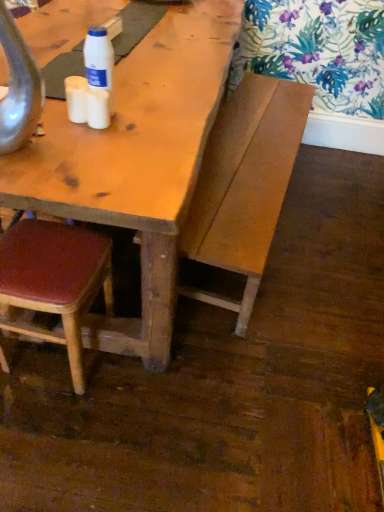
Question: Is white plastic bottle at upper center at the right side of wooden bench at center?

Choices:
 (A) no
 (B) yes

Answer: (A)

Question: Is the depth of white plastic bottle at upper center less than that of wooden bench at center?

Choices:
 (A) yes
 (B) no

Answer: (A)

Question: Is white plastic bottle at upper center bigger than wooden bench at center?

Choices:
 (A) no
 (B) yes

Answer: (A)

Question: From the image's perspective, is white plastic bottle at upper center located beneath wooden bench at center?

Choices:
 (A) yes
 (B) no

Answer: (B)

Question: Is white plastic bottle at upper center wider than wooden bench at center?

Choices:
 (A) no
 (B) yes

Answer: (A)

Question: Is white plastic bottle at upper center further to the viewer compared to wooden bench at center?

Choices:
 (A) no
 (B) yes

Answer: (A)

Question: Is white matte cup at center, placed as the first coffee cup when sorted from left to right, bigger than leatherette chair at lower left?

Choices:
 (A) no
 (B) yes

Answer: (A)

Question: From a real-world perspective, is white matte cup at center, placed as the first coffee cup when sorted from left to right, over leatherette chair at lower left?

Choices:
 (A) yes
 (B) no

Answer: (A)

Question: From the image's perspective, would you say white matte cup at center, placed as the first coffee cup when sorted from left to right, is shown under leatherette chair at lower left?

Choices:
 (A) yes
 (B) no

Answer: (B)

Question: Is white matte cup at center, placed as the first coffee cup when sorted from left to right, not within leatherette chair at lower left?

Choices:
 (A) yes
 (B) no

Answer: (A)

Question: Does white matte cup at center, placed as the first coffee cup when sorted from left to right, lie in front of leatherette chair at lower left?

Choices:
 (A) no
 (B) yes

Answer: (B)

Question: Is white matte cup at center, arranged as the second coffee cup when viewed from the right, thinner than leatherette chair at lower left?

Choices:
 (A) no
 (B) yes

Answer: (B)

Question: Is white plastic bottle at upper center behind white matte cup at center, placed as the first coffee cup when sorted from left to right?

Choices:
 (A) yes
 (B) no

Answer: (B)